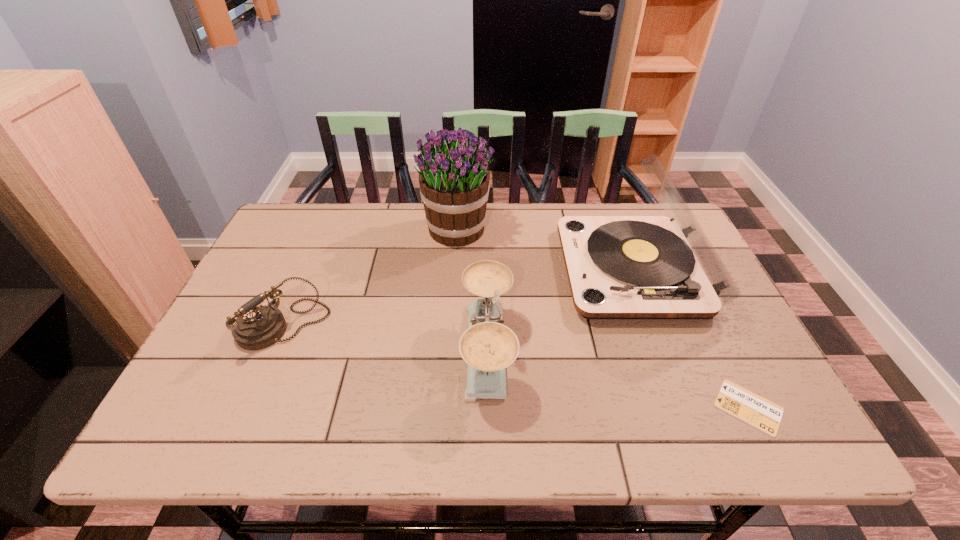
Locate an element on the screen. The height and width of the screenshot is (540, 960). record player located at the right edge is located at coordinates (619, 267).

The width and height of the screenshot is (960, 540). Find the location of `identity card located in the right edge section of the desktop`. identity card located in the right edge section of the desktop is located at coordinates (739, 402).

This screenshot has height=540, width=960. I want to click on object present at the far right corner, so tap(619, 267).

The image size is (960, 540). I want to click on object that is positioned at the near right corner, so click(x=739, y=402).

Image resolution: width=960 pixels, height=540 pixels. In order to click on free region at the far edge of the desktop in this screenshot , I will do `click(531, 207)`.

Identify the location of vacant space at the near edge of the desktop. This screenshot has height=540, width=960. (314, 432).

The height and width of the screenshot is (540, 960). What are the coordinates of `free space at the left edge` in the screenshot? It's located at (292, 317).

Identify the location of vacant area that lies between the telephone and the shortest object. (516, 367).

Identify the location of free spot between the bouquet and the telephone. (371, 277).

The width and height of the screenshot is (960, 540). Find the location of `free space that is in between the shortest object and the record player`. free space that is in between the shortest object and the record player is located at coordinates (691, 339).